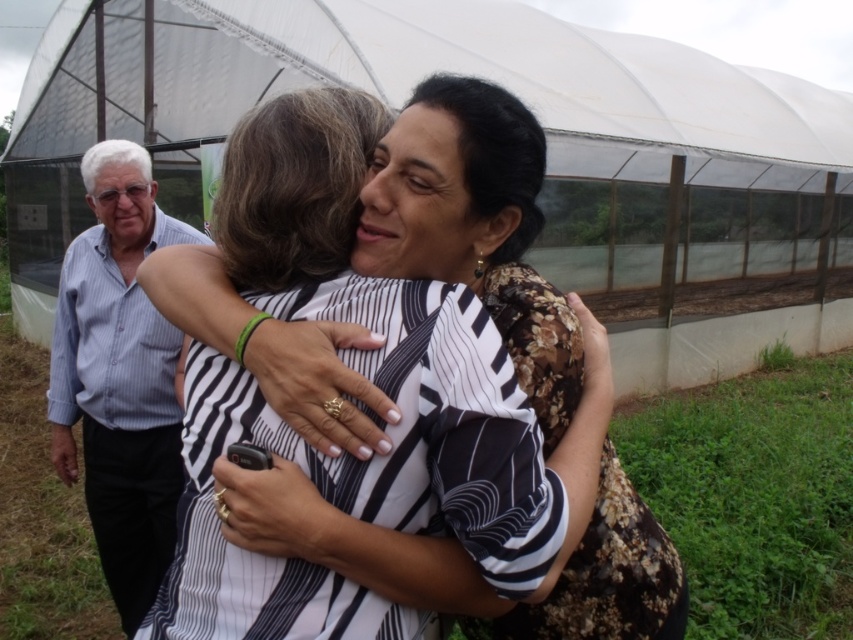
You are a fashion designer observing two shirts in the image. The striped fabric shirt at center and the blue striped shirt at left. Which one has a greater width?

The striped fabric shirt at center has a greater width than the blue striped shirt at left.

You are planning to take a photo of both the black floral dress at center and the blue striped shirt at left. Which one would you need to zoom in more on to capture details, considering their sizes?

The black floral dress at center has a lesser width compared to the blue striped shirt at left, so you would need to zoom in more on the black floral dress at center to capture its details since it is smaller in size.